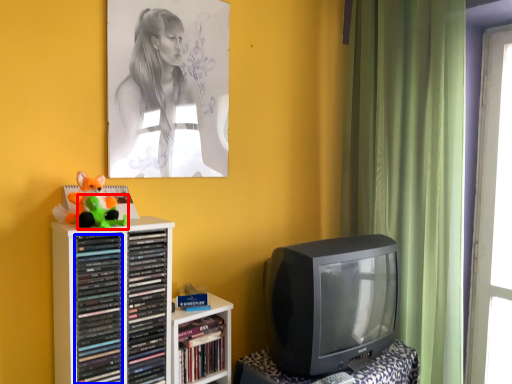
Question: Which point is further to the camera, toy (highlighted by a red box) or book (highlighted by a blue box)?

Choices:
 (A) toy
 (B) book

Answer: (B)